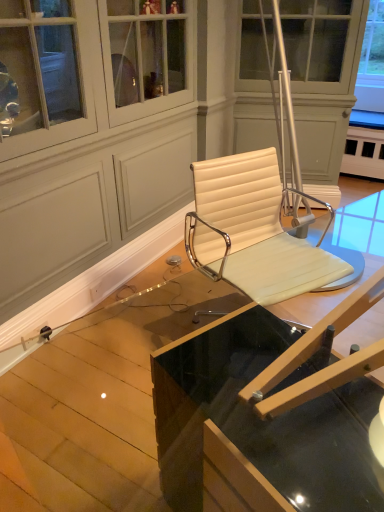
Question: Considering the positions of transparent glass table at center, the 2th table when ordered from front to back, and clear glass table at center, the second table viewed from the back, in the image, is transparent glass table at center, the 2th table when ordered from front to back, taller or shorter than clear glass table at center, the second table viewed from the back,?

Choices:
 (A) short
 (B) tall

Answer: (A)

Question: Considering the positions of transparent glass table at center, the 2th table when ordered from front to back, and clear glass table at center, the second table viewed from the back, in the image, is transparent glass table at center, the 2th table when ordered from front to back, bigger or smaller than clear glass table at center, the second table viewed from the back,?

Choices:
 (A) big
 (B) small

Answer: (B)

Question: Estimate the real-world distances between objects in this image. Which object is closer to the transparent glass table at center, which is counted as the first table, starting from the back?

Choices:
 (A) clear glass table at center, the second table viewed from the back
 (B) white leather chair at center

Answer: (B)

Question: Which object is the farthest from the white leather chair at center?

Choices:
 (A) clear glass table at center, the second table viewed from the back
 (B) transparent glass table at center, which is counted as the first table, starting from the back

Answer: (A)